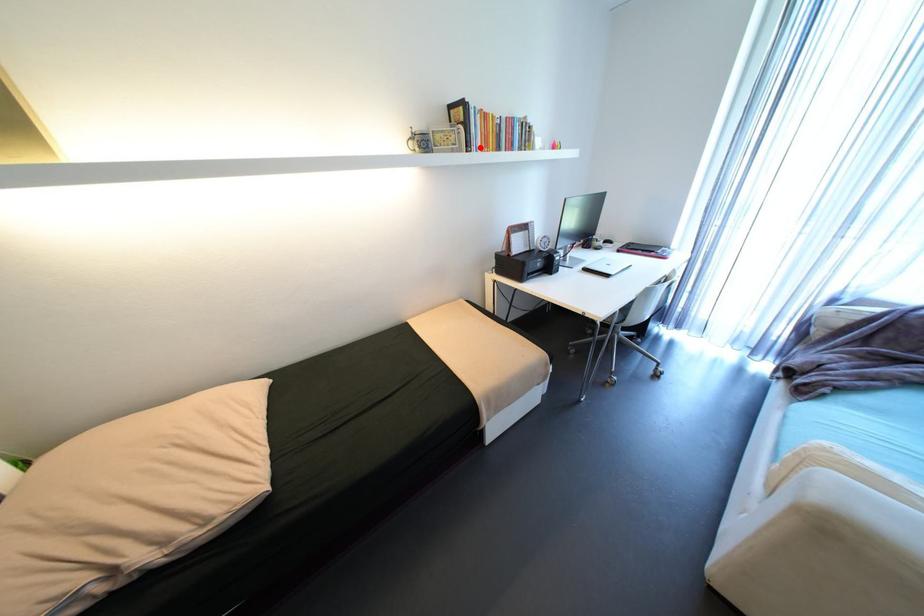
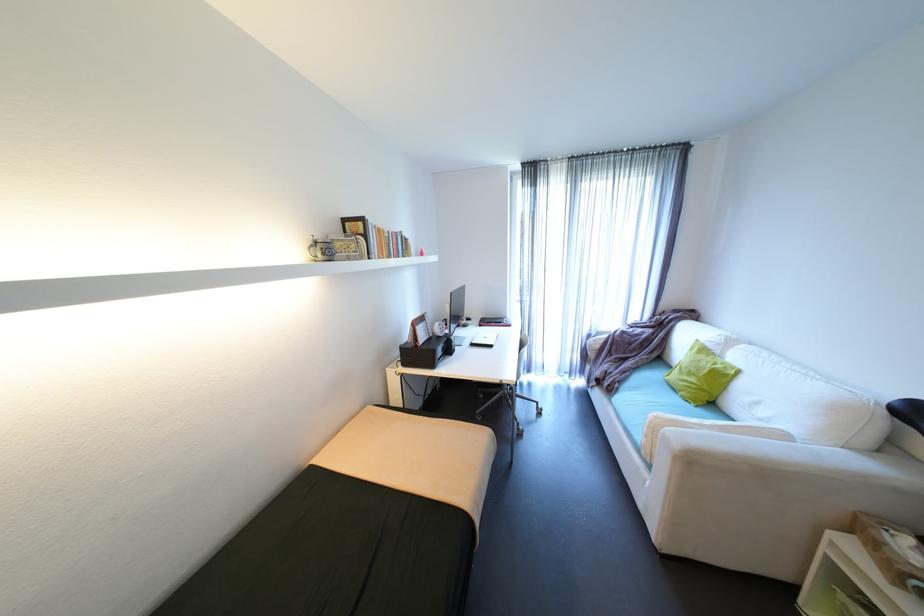
Question: I am providing you with two images of the same scene from different viewpoints. A red point is marked on the first image. Can you still see the location of the red point in image 2?

Choices:
 (A) Yes
 (B) No

Answer: (A)